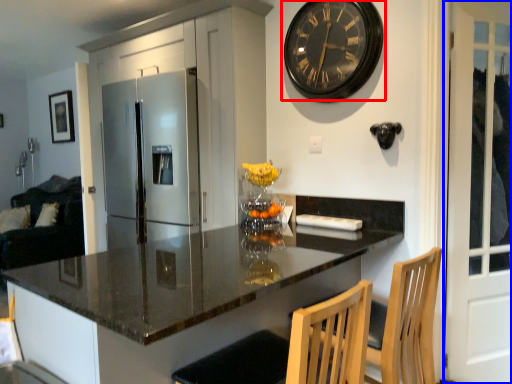
Question: Among these objects, which one is nearest to the camera, wall clock (highlighted by a red box) or screen door (highlighted by a blue box)?

Choices:
 (A) wall clock
 (B) screen door

Answer: (B)